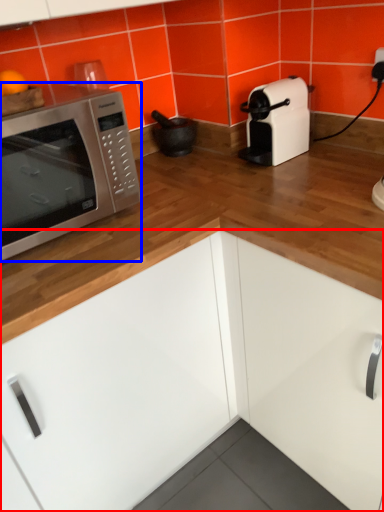
Question: Which point is further to the camera, cabinetry (highlighted by a red box) or microwave oven (highlighted by a blue box)?

Choices:
 (A) cabinetry
 (B) microwave oven

Answer: (B)